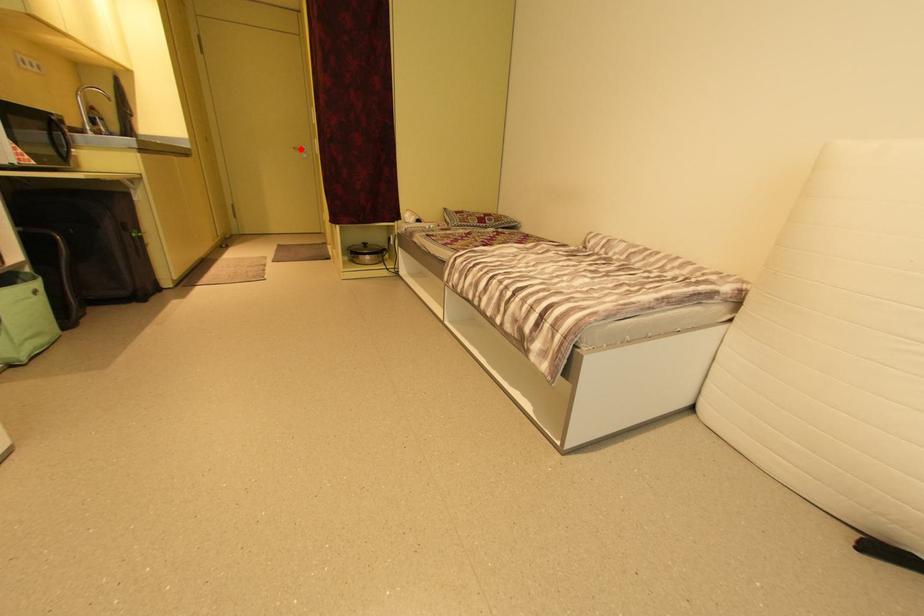
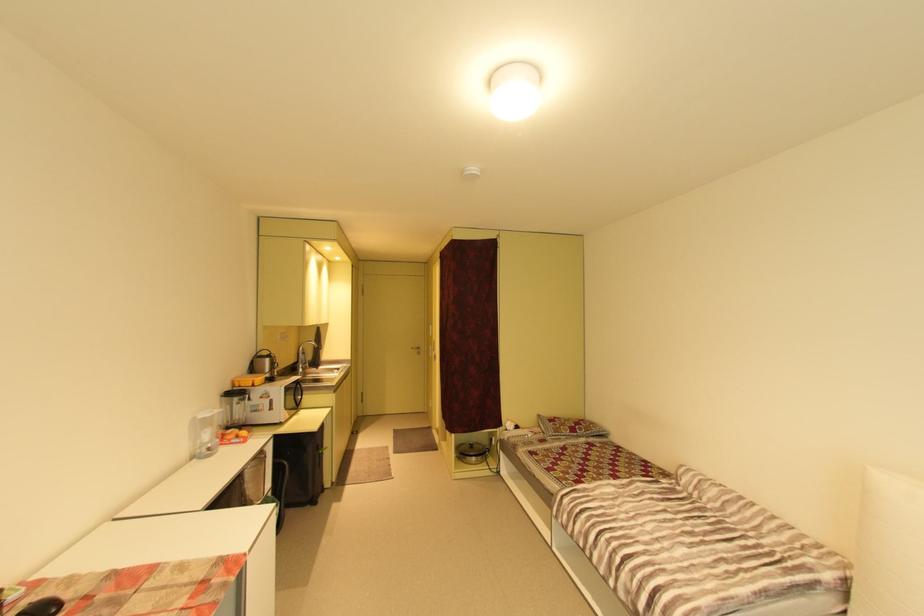
Question: I am providing you with two images of the same scene from different viewpoints. In image1, a red point is highlighted. Considering the same 3D point in image2, which of the following is correct?

Choices:
 (A) It is closer
 (B) It is farther

Answer: (B)